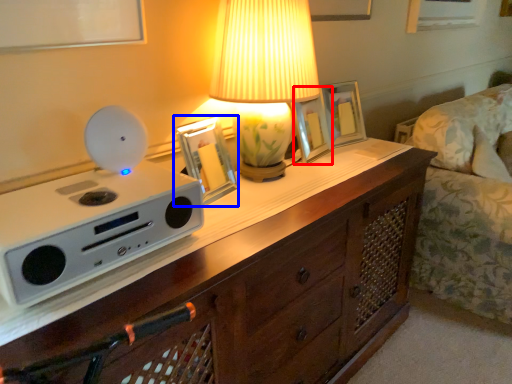
Question: Which object appears closest to the camera in this image, picture frame (highlighted by a red box) or picture frame (highlighted by a blue box)?

Choices:
 (A) picture frame
 (B) picture frame

Answer: (B)